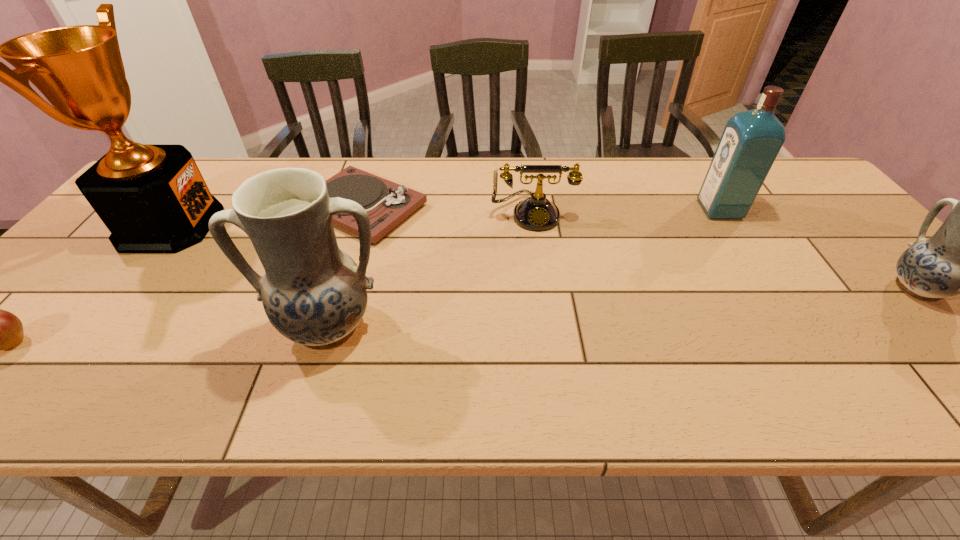
You are a GUI agent. You are given a task and a screenshot of the screen. Output one action in this format:
    pyautogui.click(x=<x>, y=<y>)
    Task: Click on the vacant space at the far edge of the desktop
    
    Given the screenshot: What is the action you would take?
    pyautogui.click(x=695, y=161)

At what (x,y) coordinates should I click in order to perform the action: click on vacant area at the right edge of the desktop. Please return your answer as a coordinate pair (x, y). This screenshot has height=540, width=960. Looking at the image, I should click on (877, 265).

This screenshot has width=960, height=540. In the image, there is a desktop. In order to click on vacant region at the far right corner in this screenshot , I will do `click(809, 193)`.

You are a GUI agent. You are given a task and a screenshot of the screen. Output one action in this format:
    pyautogui.click(x=<x>, y=<y>)
    Task: Click on the vacant region at the near right corner of the desktop
    
    Given the screenshot: What is the action you would take?
    pyautogui.click(x=913, y=335)

The height and width of the screenshot is (540, 960). In order to click on free spot between the liquor and the left pottery in this screenshot , I will do (x=523, y=268).

What are the coordinates of `object that ranks as the fifth closest to the tallest object` in the screenshot? It's located at (751, 140).

Identify the location of the fifth closest object to the rightmost object. (152, 198).

Find the location of `free space that satisfies the following two spatial constraints: 1. on the flat label side of the liquor; 2. on the front side of the taller pottery`. free space that satisfies the following two spatial constraints: 1. on the flat label side of the liquor; 2. on the front side of the taller pottery is located at coordinates (794, 326).

At what (x,y) coordinates should I click in order to perform the action: click on blank space that satisfies the following two spatial constraints: 1. on the flat label side of the liquor; 2. on the dial of the fifth object from left to right. Please return your answer as a coordinate pair (x, y). Looking at the image, I should click on (722, 213).

This screenshot has height=540, width=960. In order to click on vacant area that satisfies the following two spatial constraints: 1. on the front of the trophy cup with the label; 2. on the right side of the taller pottery in this screenshot , I will do `click(90, 326)`.